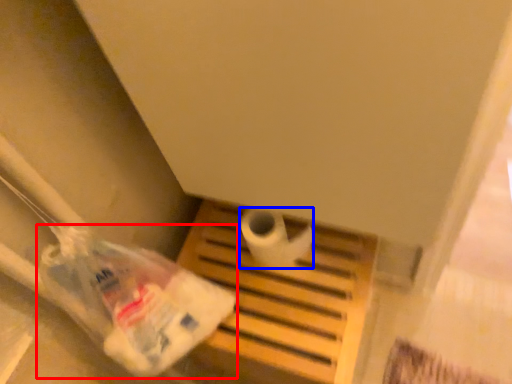
Question: Among these objects, which one is nearest to the camera, plastic bag (highlighted by a red box) or toilet paper (highlighted by a blue box)?

Choices:
 (A) plastic bag
 (B) toilet paper

Answer: (A)